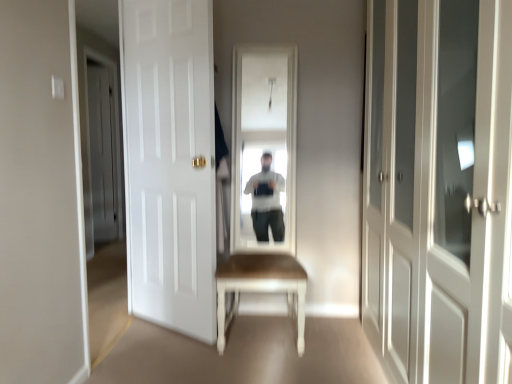
This screenshot has height=384, width=512. Find the location of `vacant space in white matte door at center, which appears as the second door when viewed from the right (from a real-world perspective)`. vacant space in white matte door at center, which appears as the second door when viewed from the right (from a real-world perspective) is located at coordinates (168, 324).